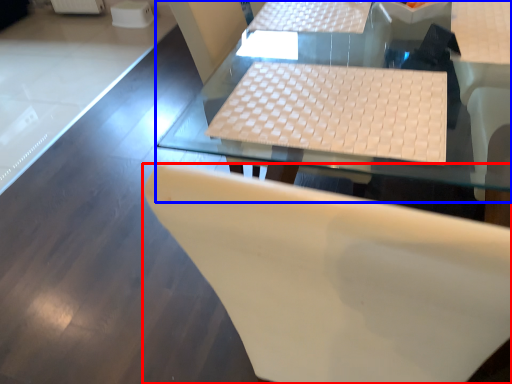
Question: Among these objects, which one is farthest to the camera, chair (highlighted by a red box) or table (highlighted by a blue box)?

Choices:
 (A) chair
 (B) table

Answer: (B)